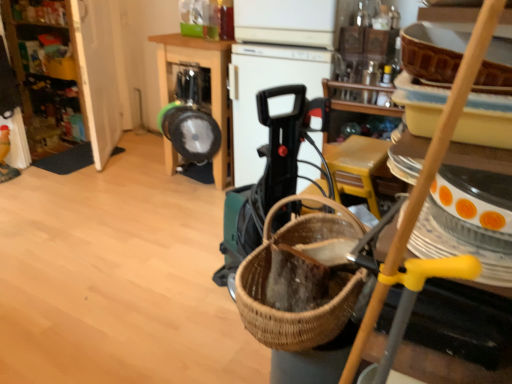
The height and width of the screenshot is (384, 512). Describe the element at coordinates (70, 71) in the screenshot. I see `wooden cabinet at left` at that location.

What is the approximate width of wooden cabinet at left?

wooden cabinet at left is 4.94 inches wide.

In order to face brown woven basket at center, should I rotate leftwards or rightwards?

To face it directly, rotate right by 8.617 degrees.

Image resolution: width=512 pixels, height=384 pixels. In order to click on black plastic vacuum cleaner at center, acting as the first appliance starting from the right in this screenshot , I will do `click(265, 88)`.

The height and width of the screenshot is (384, 512). I want to click on metallic silver frying pan at center, so click(211, 88).

Where is `metallic silver blender at center, which is the 1th appliance in left-to-right order`? metallic silver blender at center, which is the 1th appliance in left-to-right order is located at coordinates (189, 119).

The width and height of the screenshot is (512, 384). In order to click on the 2nd appliance to the right of the wooden cabinet at left, counting from the anchor's position in this screenshot , I will do `click(265, 88)`.

Is black plastic vacuum cleaner at center, acting as the first appliance starting from the right, positioned far away from wooden cabinet at left?

Indeed, black plastic vacuum cleaner at center, acting as the first appliance starting from the right, is not near wooden cabinet at left.

From the image's perspective, is black plastic vacuum cleaner at center, acting as the first appliance starting from the right, located above or below wooden cabinet at left?

black plastic vacuum cleaner at center, acting as the first appliance starting from the right, is situated lower than wooden cabinet at left in the image.

In the scene shown: Between black plastic vacuum cleaner at center, the second appliance in the left-to-right sequence, and wooden cabinet at left, which one has smaller width?

With smaller width is wooden cabinet at left.

Considering the sizes of objects black plastic vacuum cleaner at center, the second appliance in the left-to-right sequence, and brown woven basket at center in the image provided, who is thinner, black plastic vacuum cleaner at center, the second appliance in the left-to-right sequence, or brown woven basket at center?

Thinner between the two is brown woven basket at center.

From the image's perspective, is black plastic vacuum cleaner at center, the second appliance in the left-to-right sequence, located above or below brown woven basket at center?

black plastic vacuum cleaner at center, the second appliance in the left-to-right sequence, is situated higher than brown woven basket at center in the image.

This screenshot has height=384, width=512. I want to click on appliance to the right of brown woven basket at center, so click(265, 88).

Is point (314, 94) closer to viewer compared to point (259, 315)?

No, it is behind (259, 315).

Is black plastic vacuum cleaner at center, acting as the first appliance starting from the right, positioned behind metallic silver frying pan at center?

No, black plastic vacuum cleaner at center, acting as the first appliance starting from the right, is closer to the camera.

Does black plastic vacuum cleaner at center, acting as the first appliance starting from the right, have a larger size compared to metallic silver frying pan at center?

Incorrect, black plastic vacuum cleaner at center, acting as the first appliance starting from the right, is not larger than metallic silver frying pan at center.

Are black plastic vacuum cleaner at center, acting as the first appliance starting from the right, and metallic silver frying pan at center making contact?

No.

Does point (101, 86) come closer to viewer compared to point (334, 337)?

No.

From the image's perspective, is wooden cabinet at left on top of brown woven basket at center?

Indeed, from the image's perspective, wooden cabinet at left is shown above brown woven basket at center.

Is wooden cabinet at left inside the boundaries of brown woven basket at center, or outside?

wooden cabinet at left is spatially situated outside brown woven basket at center.

The width and height of the screenshot is (512, 384). In the image, there is a brown woven basket at center. What are the coordinates of `cabinetry above it (from the image's perspective)` in the screenshot? It's located at (70, 71).

Does metallic silver frying pan at center have a lesser height compared to metallic silver blender at center, which is the 1th appliance in left-to-right order?

Incorrect, the height of metallic silver frying pan at center does not fall short of that of metallic silver blender at center, which is the 1th appliance in left-to-right order.

How different are the orientations of metallic silver frying pan at center and metallic silver blender at center, which is the 1th appliance in left-to-right order, in degrees?

There is a 0.00138-degree angle between the facing directions of metallic silver frying pan at center and metallic silver blender at center, which is the 1th appliance in left-to-right order.

Is metallic silver frying pan at center directly adjacent to metallic silver blender at center, which is the 1th appliance in left-to-right order?

No, metallic silver frying pan at center is not next to metallic silver blender at center, which is the 1th appliance in left-to-right order.

Can we say metallic silver frying pan at center lies outside metallic silver blender at center, placed as the 2th appliance when sorted from right to left?

metallic silver frying pan at center is positioned outside metallic silver blender at center, placed as the 2th appliance when sorted from right to left.

Does point (346, 230) appear closer or farther from the camera than point (30, 27)?

Point (346, 230).

Which is correct: brown woven basket at center is inside wooden cabinet at left, or outside of it?

The correct answer is: outside.

Is brown woven basket at center to the left of wooden cabinet at left from the viewer's perspective?

No.

Could you tell me if brown woven basket at center is facing metallic silver blender at center, which is the 1th appliance in left-to-right order?

No.

From a real-world perspective, is brown woven basket at center above or below metallic silver blender at center, which is the 1th appliance in left-to-right order?

Clearly, from a real-world perspective, brown woven basket at center is below metallic silver blender at center, which is the 1th appliance in left-to-right order.

Can you confirm if brown woven basket at center is thinner than metallic silver blender at center, which is the 1th appliance in left-to-right order?

Incorrect, the width of brown woven basket at center is not less than that of metallic silver blender at center, which is the 1th appliance in left-to-right order.

From the image's perspective, which is above, brown woven basket at center or metallic silver blender at center, which is the 1th appliance in left-to-right order?

metallic silver blender at center, which is the 1th appliance in left-to-right order, is shown above in the image.

Locate an element on the screen. the 2nd appliance counting from the right side of the wooden cabinet at left is located at coordinates (265, 88).

Locate an element on the screen. basket to the left of black plastic vacuum cleaner at center, acting as the first appliance starting from the right is located at coordinates (328, 284).

When comparing their distances from metallic silver blender at center, which is the 1th appliance in left-to-right order, does wooden cabinet at left or brown woven basket at center seem further?

Based on the image, wooden cabinet at left appears to be further to metallic silver blender at center, which is the 1th appliance in left-to-right order.

Which object lies nearer to the anchor point wooden cabinet at left, metallic silver blender at center, placed as the 2th appliance when sorted from right to left, or metallic silver frying pan at center?

Based on the image, metallic silver frying pan at center appears to be nearer to wooden cabinet at left.

Which object lies nearer to the anchor point metallic silver blender at center, placed as the 2th appliance when sorted from right to left, black plastic vacuum cleaner at center, acting as the first appliance starting from the right, or wooden cabinet at left?

black plastic vacuum cleaner at center, acting as the first appliance starting from the right.

Looking at the image, which one is located closer to metallic silver frying pan at center, wooden cabinet at left or black plastic vacuum cleaner at center, acting as the first appliance starting from the right?

Based on the image, black plastic vacuum cleaner at center, acting as the first appliance starting from the right, appears to be nearer to metallic silver frying pan at center.

From the image, which object appears to be farther from wooden cabinet at left, metallic silver blender at center, placed as the 2th appliance when sorted from right to left, or brown woven basket at center?

Among the two, brown woven basket at center is located further to wooden cabinet at left.

Looking at the image, which one is located further to metallic silver frying pan at center, brown woven basket at center or black plastic vacuum cleaner at center, acting as the first appliance starting from the right?

Among the two, brown woven basket at center is located further to metallic silver frying pan at center.

From the picture: Looking at the image, which one is located closer to brown woven basket at center, wooden cabinet at left or metallic silver blender at center, placed as the 2th appliance when sorted from right to left?

The object closer to brown woven basket at center is metallic silver blender at center, placed as the 2th appliance when sorted from right to left.

Looking at the image, which one is located further to metallic silver frying pan at center, black plastic vacuum cleaner at center, acting as the first appliance starting from the right, or wooden cabinet at left?

wooden cabinet at left lies further to metallic silver frying pan at center than the other object.

Find the location of a particular element. This screenshot has width=512, height=384. furniture situated between metallic silver blender at center, which is the 1th appliance in left-to-right order, and black plastic vacuum cleaner at center, the second appliance in the left-to-right sequence, from left to right is located at coordinates (211, 88).

The height and width of the screenshot is (384, 512). In order to click on appliance located between brown woven basket at center and metallic silver blender at center, placed as the 2th appliance when sorted from right to left, in the depth direction in this screenshot , I will do `click(265, 88)`.

This screenshot has height=384, width=512. In order to click on furniture between brown woven basket at center and wooden cabinet at left along the z-axis in this screenshot , I will do `click(211, 88)`.

I want to click on basket between wooden cabinet at left and black plastic vacuum cleaner at center, the second appliance in the left-to-right sequence, so click(x=328, y=284).